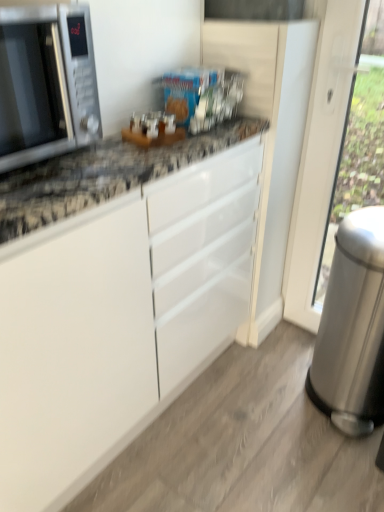
Question: Considering their positions, is silver metallic trash can at right located in front of or behind satin silver microwave at left?

Choices:
 (A) behind
 (B) front

Answer: (A)

Question: Based on their positions, is silver metallic trash can at right located to the left or right of satin silver microwave at left?

Choices:
 (A) right
 (B) left

Answer: (A)

Question: Is silver metallic trash can at right bigger or smaller than satin silver microwave at left?

Choices:
 (A) small
 (B) big

Answer: (B)

Question: Based on their sizes in the image, would you say satin silver microwave at left is bigger or smaller than silver metallic trash can at right?

Choices:
 (A) small
 (B) big

Answer: (A)

Question: Does point (69, 117) appear closer or farther from the camera than point (367, 304)?

Choices:
 (A) closer
 (B) farther

Answer: (A)

Question: From a real-world perspective, relative to silver metallic trash can at right, is satin silver microwave at left vertically above or below?

Choices:
 (A) below
 (B) above

Answer: (B)

Question: Is satin silver microwave at left wider or thinner than silver metallic trash can at right?

Choices:
 (A) wide
 (B) thin

Answer: (A)